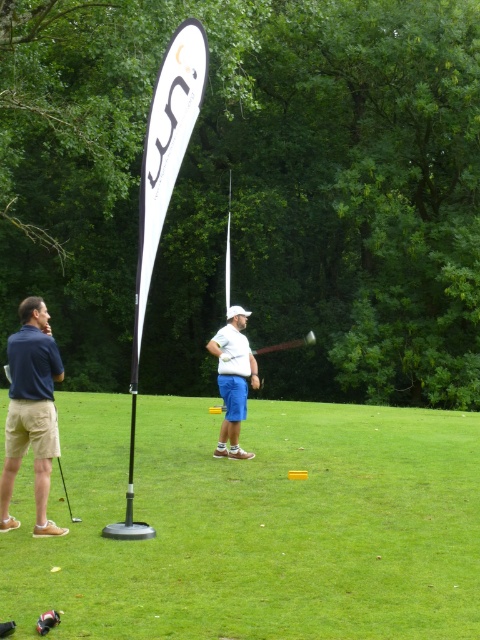
Does dark blue shirt at left appear over wooden shaft at center?

Correct, dark blue shirt at left is located above wooden shaft at center.

Does dark blue shirt at left have a greater height compared to wooden shaft at center?

No.

Is point (45, 321) positioned after point (276, 346)?

No.

Find the location of a particular element. dark blue shirt at left is located at coordinates (32, 412).

Can you confirm if green grass at center is shorter than wooden shaft at center?

Correct, green grass at center is not as tall as wooden shaft at center.

The width and height of the screenshot is (480, 640). What do you see at coordinates (254, 524) in the screenshot?
I see `green grass at center` at bounding box center [254, 524].

I want to click on green grass at center, so click(x=254, y=524).

Where is `green grass at center`? The width and height of the screenshot is (480, 640). green grass at center is located at coordinates (254, 524).

Does dark blue shirt at left have a greater height compared to white matte golf club at center?

In fact, dark blue shirt at left may be shorter than white matte golf club at center.

Is point (6, 420) positioned behind point (227, 353)?

That is False.

Is point (32, 326) farther from viewer compared to point (227, 432)?

No, (32, 326) is closer to viewer.

Locate an element on the screen. The image size is (480, 640). dark blue shirt at left is located at coordinates (32, 412).